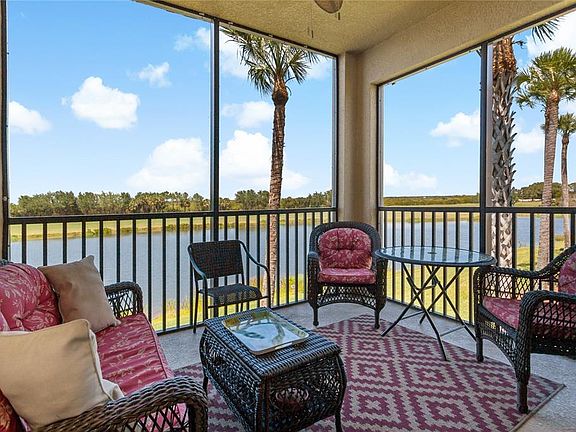
The width and height of the screenshot is (576, 432). In order to click on ceiling in this screenshot , I will do `click(370, 15)`.